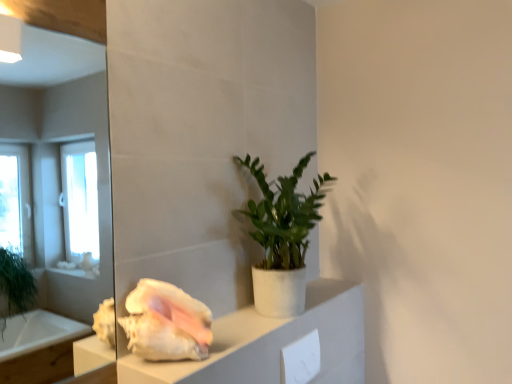
I want to click on vacant space situated above white matte cabinet at center (from a real-world perspective), so click(249, 322).